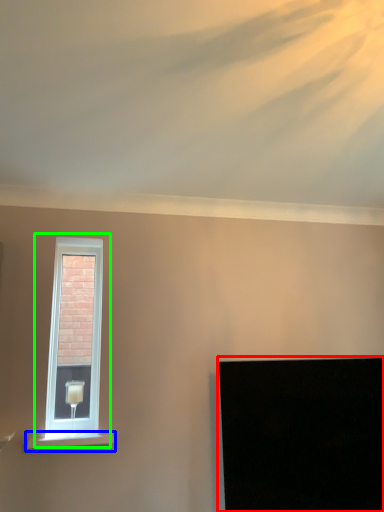
Question: Considering the real-world distances, which object is closest to computer screen (highlighted by a red box)? window sill (highlighted by a blue box) or window (highlighted by a green box).

Choices:
 (A) window sill
 (B) window

Answer: (A)